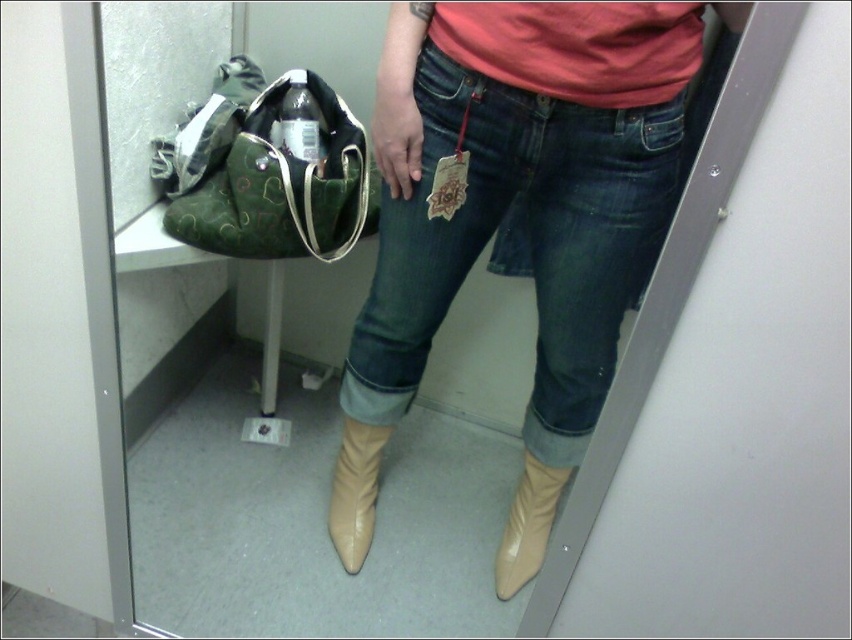
You are trying to decide if the green canvas handbag at left can fit into the space between the denim at center and the wall. Based on their widths, can it fit?

The denim at center might be wider than the green canvas handbag at left, so there is uncertainty about whether the handbag can fit into the space between the denim and the wall. Further measurement or visual estimation would be needed to confirm.

You are a fashion designer trying to place a new accessory on the denim at center. According to the coordinates provided, where exactly should you position the accessory on the denim?

The denim at center should have the accessory placed at the coordinates point (528, 241) as specified.